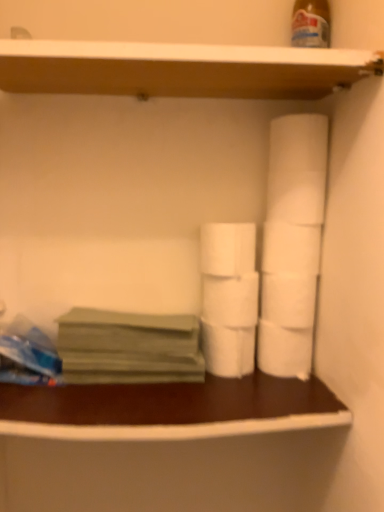
Where is `vacant space to the right of green matte paper at left`? vacant space to the right of green matte paper at left is located at coordinates (252, 392).